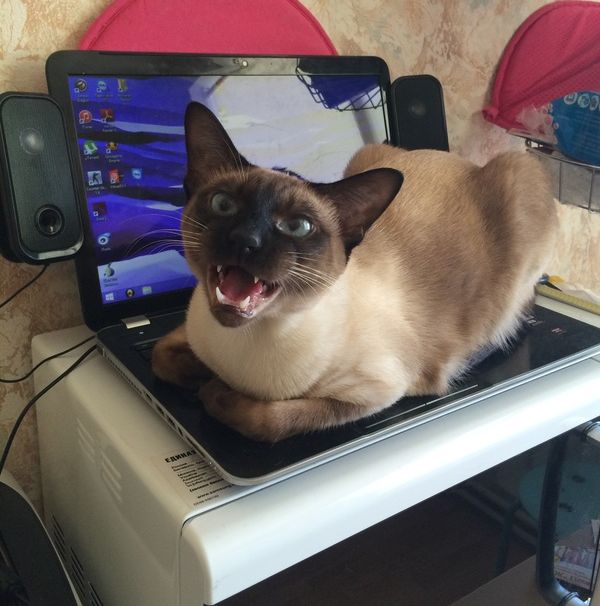
Where is `cords`? cords is located at coordinates (114, 325), (85, 355).